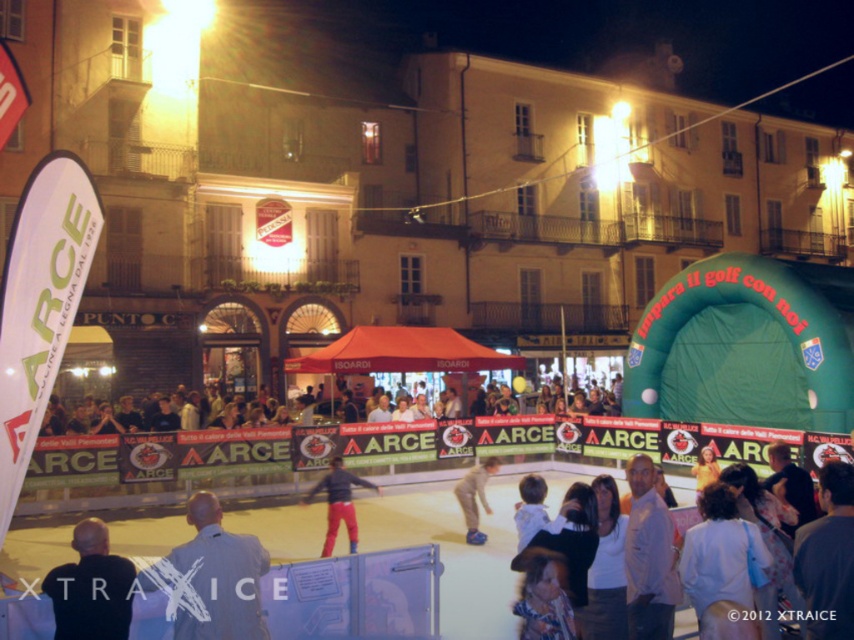
Who is positioned more to the right, light gray shirt at center or matte black tent at center?

Positioned to the right is matte black tent at center.

Who is more distant from viewer, (253, 545) or (525, 385)?

Positioned behind is point (525, 385).

Measure the distance between light gray shirt at center and camera.

light gray shirt at center and camera are 78.28 feet apart.

Where is `light gray shirt at center`? light gray shirt at center is located at coordinates (211, 577).

Does light gray jacket at lower left lie in front of red pants at center?

Yes, it is.

Can you confirm if light gray jacket at lower left is bigger than red pants at center?

Actually, light gray jacket at lower left might be smaller than red pants at center.

Who is more forward, (75, 632) or (344, 500)?

Point (75, 632)

Locate an element on the screen. The width and height of the screenshot is (854, 640). light gray jacket at lower left is located at coordinates (91, 588).

Consider the image. Is light gray shirt at center closer to camera compared to red pants at center?

Yes, light gray shirt at center is closer to the viewer.

Can you confirm if light gray shirt at center is shorter than red pants at center?

In fact, light gray shirt at center may be taller than red pants at center.

Who is more distant from viewer, (176, 556) or (342, 500)?

Point (342, 500)

The height and width of the screenshot is (640, 854). I want to click on light gray shirt at center, so click(211, 577).